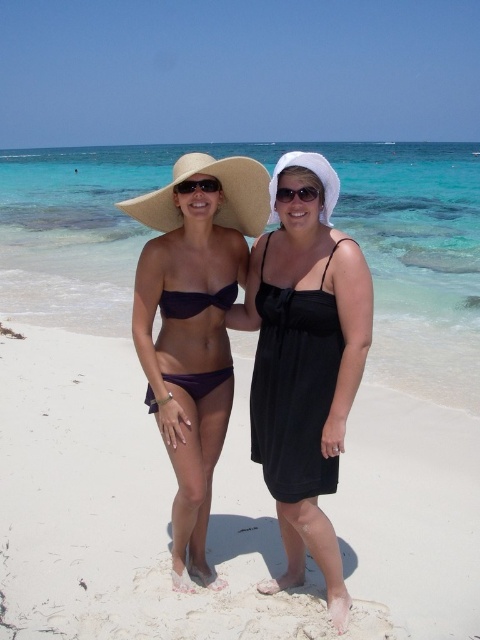
You are a photographer taking a picture of the two people on the beach. You notice the white sandy beach at center and the sunglasses at center. Which object is positioned lower in the image?

The white sandy beach at center is located below the sunglasses at center, so it is positioned lower in the image.

You are a photographer trying to capture a closeup shot of the purple matte bikini at center and the black plastic sunglasses at center. Given that your camera has a minimum focusing distance of 25 inches, will you be able to take the photo without moving closer?

The purple matte bikini at center is 24.89 inches away from the black plastic sunglasses at center. Since the minimum focusing distance is 25 inches, the camera cannot focus on the objects as they are slightly closer than required. Move a bit further back to ensure both are within the focusing range.